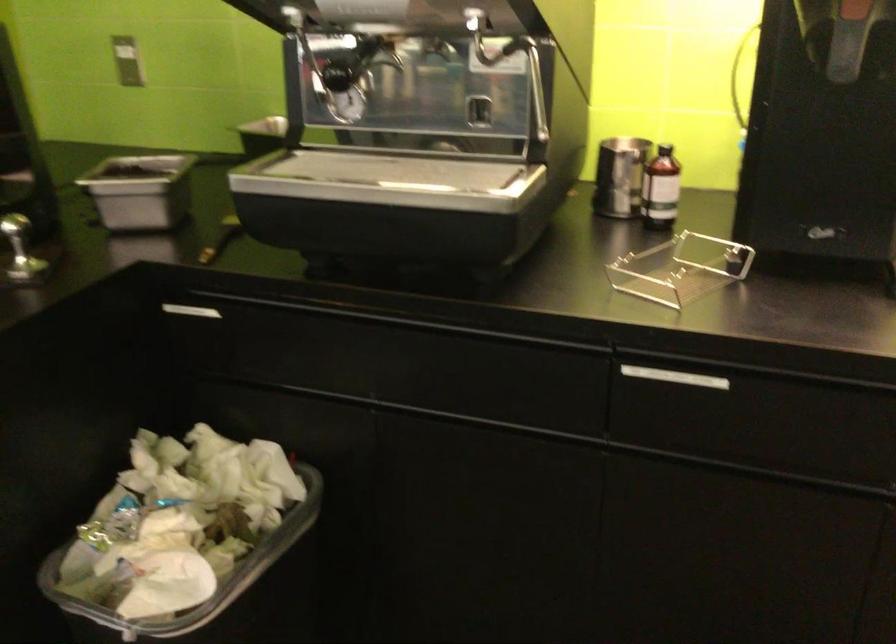
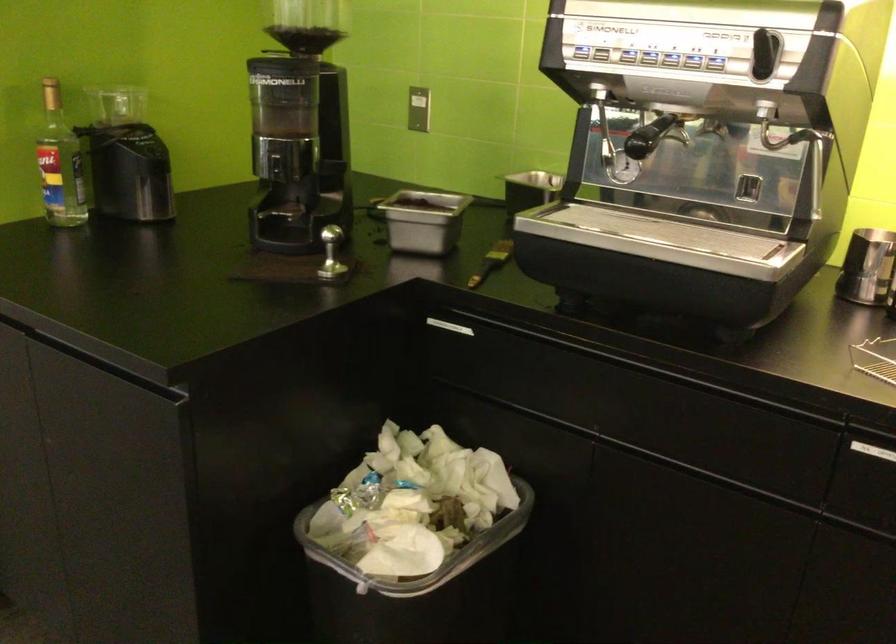
Question: The camera is either moving clockwise (left) or counter-clockwise (right) around the object. The first image is from the beginning of the video and the second image is from the end. Is the camera moving left or right when shooting the video?

Choices:
 (A) Left
 (B) Right

Answer: (B)